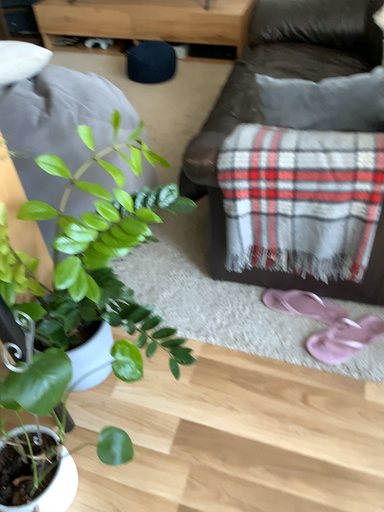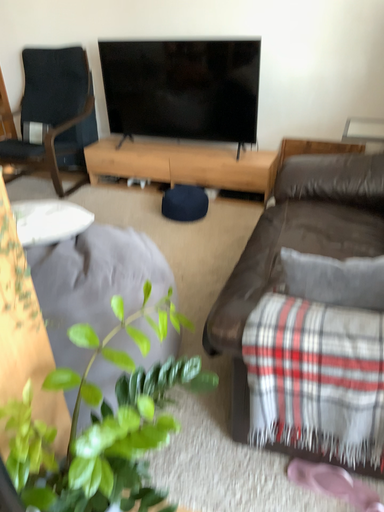
Question: Which way did the camera rotate in the video?

Choices:
 (A) rotated downward
 (B) rotated upward

Answer: (B)